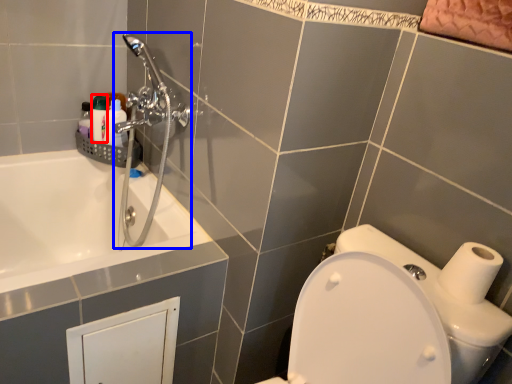
Question: Which object is closer to the camera taking this photo, toiletry (highlighted by a red box) or shower (highlighted by a blue box)?

Choices:
 (A) toiletry
 (B) shower

Answer: (B)